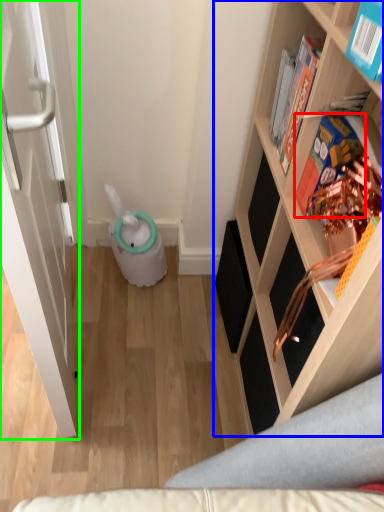
Question: Which object is positioned closest to book (highlighted by a red box)? Select from shelf (highlighted by a blue box) and door (highlighted by a green box).

Choices:
 (A) shelf
 (B) door

Answer: (A)